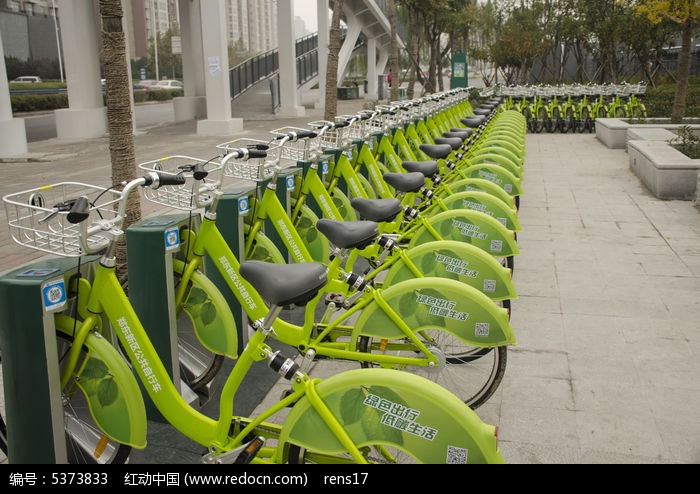
I want to click on pillars, so click(x=80, y=70), click(x=8, y=110), click(x=192, y=60), click(x=222, y=86), click(x=287, y=69), click(x=322, y=45), click(x=349, y=44), click(x=372, y=70), click(x=386, y=63).